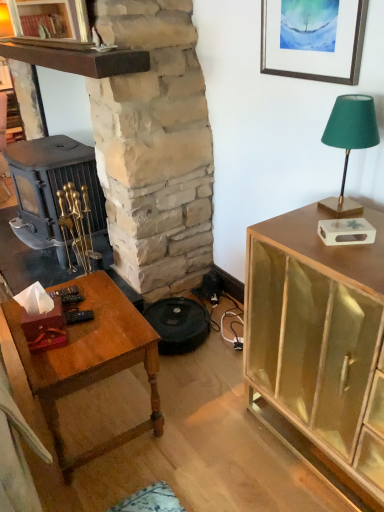
Question: Considering the positions of point (190, 23) and point (337, 131), is point (190, 23) closer or farther from the camera than point (337, 131)?

Choices:
 (A) closer
 (B) farther

Answer: (B)

Question: From the image's perspective, is stone fireplace at center above or below green fabric lampshade at upper right?

Choices:
 (A) below
 (B) above

Answer: (B)

Question: Which object is positioned closest to the wooden table at lower left?

Choices:
 (A) silver metallic picture frame at upper right
 (B) matte gold cabinet at right
 (C) green fabric lampshade at upper right
 (D) stone fireplace at center

Answer: (B)

Question: Considering the real-world distances, which object is closest to the matte gold cabinet at right?

Choices:
 (A) silver metallic picture frame at upper right
 (B) green fabric lampshade at upper right
 (C) wooden table at lower left
 (D) stone fireplace at center

Answer: (B)